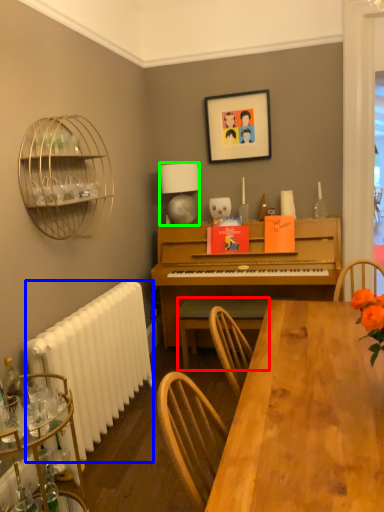
Question: Based on their relative distances, which object is nearer to chair (highlighted by a red box)? Choose from radiator (highlighted by a blue box) and lamp (highlighted by a green box).

Choices:
 (A) radiator
 (B) lamp

Answer: (A)